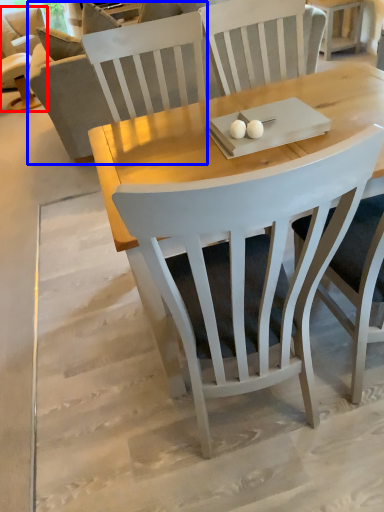
Question: Which object appears closest to the camera in this image, chair (highlighted by a red box) or couch (highlighted by a blue box)?

Choices:
 (A) chair
 (B) couch

Answer: (B)